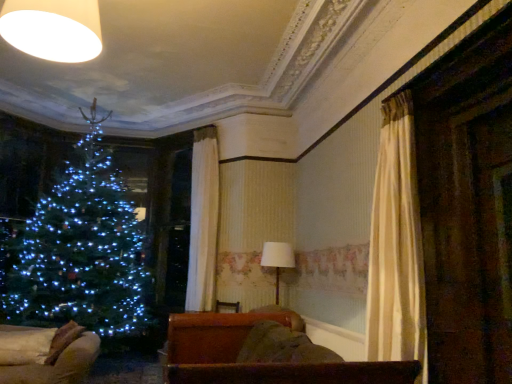
Question: Could you tell me if white fabric lampshade at center is facing brown leather couch at lower center, the second furniture viewed from the left?

Choices:
 (A) no
 (B) yes

Answer: (A)

Question: Is white fabric lampshade at center wider than brown leather couch at lower center, the second furniture viewed from the left?

Choices:
 (A) no
 (B) yes

Answer: (A)

Question: Can you confirm if white fabric lampshade at center is positioned to the left of brown leather couch at lower center, which appears as the first furniture when viewed from the front?

Choices:
 (A) no
 (B) yes

Answer: (A)

Question: Is white fabric lampshade at center not inside brown leather couch at lower center, which appears as the second furniture when viewed from the back?

Choices:
 (A) no
 (B) yes

Answer: (B)

Question: Is white fabric lampshade at center positioned with its back to brown leather couch at lower center, the second furniture viewed from the left?

Choices:
 (A) yes
 (B) no

Answer: (B)

Question: Is velvet beige sofa at lower left, which appears as the first furniture when viewed from the left, wider or thinner than white fabric lampshade at center?

Choices:
 (A) wide
 (B) thin

Answer: (A)

Question: Considering the relative positions of velvet beige sofa at lower left, which appears as the first furniture when viewed from the left, and white fabric lampshade at center in the image provided, is velvet beige sofa at lower left, which appears as the first furniture when viewed from the left, to the left or to the right of white fabric lampshade at center?

Choices:
 (A) left
 (B) right

Answer: (A)

Question: Relative to white fabric lampshade at center, is velvet beige sofa at lower left, the first furniture positioned from the back, in front or behind?

Choices:
 (A) front
 (B) behind

Answer: (A)

Question: Considering the positions of point (39, 377) and point (279, 253), is point (39, 377) closer or farther from the camera than point (279, 253)?

Choices:
 (A) farther
 (B) closer

Answer: (B)

Question: Considering the positions of white matte lampshade at upper left and brown leather couch at lower center, the second furniture viewed from the left, in the image, is white matte lampshade at upper left bigger or smaller than brown leather couch at lower center, the second furniture viewed from the left,?

Choices:
 (A) small
 (B) big

Answer: (A)

Question: Is white matte lampshade at upper left taller or shorter than brown leather couch at lower center, which appears as the second furniture when viewed from the back?

Choices:
 (A) short
 (B) tall

Answer: (A)

Question: From a real-world perspective, is white matte lampshade at upper left positioned above or below brown leather couch at lower center, which appears as the second furniture when viewed from the back?

Choices:
 (A) above
 (B) below

Answer: (A)

Question: Choose the correct answer: Is white matte lampshade at upper left inside brown leather couch at lower center, which ranks as the 1th furniture in right-to-left order, or outside it?

Choices:
 (A) inside
 (B) outside

Answer: (B)

Question: Looking at their shapes, would you say white fabric lampshade at center is wider or thinner than white matte lampshade at upper left?

Choices:
 (A) thin
 (B) wide

Answer: (A)

Question: In the image, is white fabric lampshade at center positioned in front of or behind white matte lampshade at upper left?

Choices:
 (A) behind
 (B) front

Answer: (A)